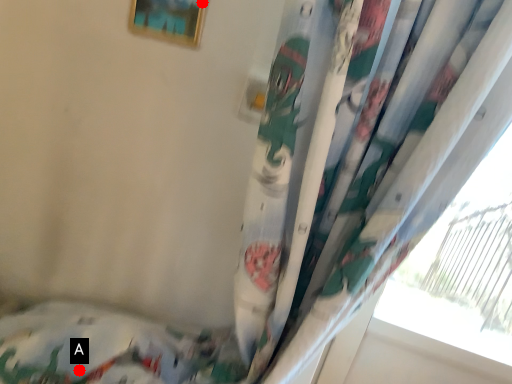
Question: Two points are circled on the image, labeled by A and B beside each circle. Among these points, which one is nearest to the camera?

Choices:
 (A) A is closer
 (B) B is closer

Answer: (B)